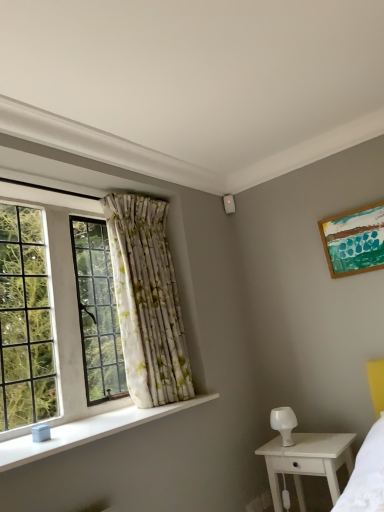
Identify the location of free space in front of white glossy lamp at lower right. (307, 450).